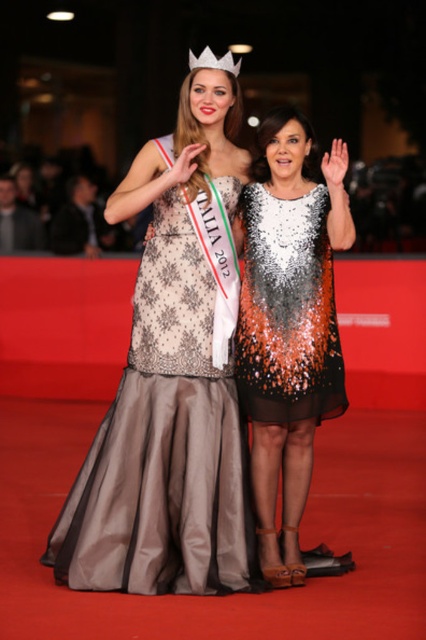
Between matte lace dress at center and matte black dress at center, which one has more height?

With more height is matte lace dress at center.

Describe the element at coordinates (167, 428) in the screenshot. I see `matte lace dress at center` at that location.

You are a GUI agent. You are given a task and a screenshot of the screen. Output one action in this format:
    pyautogui.click(x=<x>, y=<y>)
    Task: Click on the matte lace dress at center
    The image size is (426, 640).
    Given the screenshot: What is the action you would take?
    pyautogui.click(x=167, y=428)

This screenshot has width=426, height=640. What are the coordinates of `matte lace dress at center` in the screenshot? It's located at (167, 428).

Does matte lace dress at center have a lesser width compared to white plastic crown at upper center?

No, matte lace dress at center is not thinner than white plastic crown at upper center.

Can you confirm if matte lace dress at center is wider than white plastic crown at upper center?

Yes, matte lace dress at center is wider than white plastic crown at upper center.

Is point (172, 404) positioned before point (236, 76)?

Yes, point (172, 404) is closer to viewer.

This screenshot has height=640, width=426. I want to click on matte lace dress at center, so click(167, 428).

Can you confirm if sparkly sequined dress at center is shorter than matte black dress at center?

No.

Is point (258, 394) closer to viewer compared to point (65, 156)?

Yes, it is.

Identify the location of sparkly sequined dress at center. (288, 323).